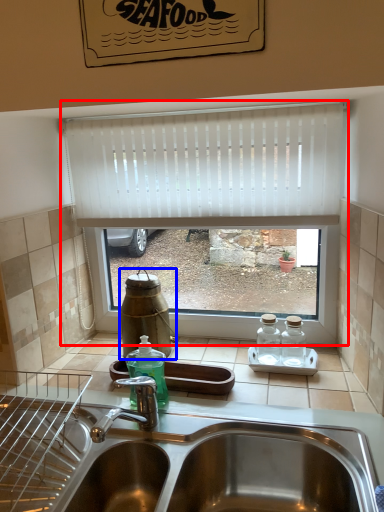
Question: Which of the following is the farthest to the observer, window (highlighted by a red box) or bottle (highlighted by a blue box)?

Choices:
 (A) window
 (B) bottle

Answer: (B)